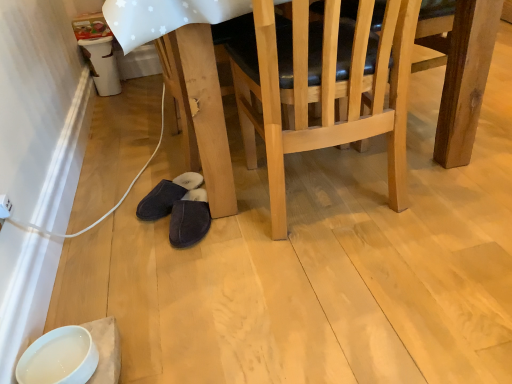
Consider the image. Measure the distance between point (189, 245) and camera.

Point (189, 245) is 4.06 feet away from camera.

How much space does dark suede slippers at lower center, marked as the second footwear in a right-to-left arrangement, occupy vertically?

It is 9.65 centimeters.

This screenshot has height=384, width=512. Describe the element at coordinates (59, 357) in the screenshot. I see `white glossy bowl at lower left` at that location.

Where is `white glossy bowl at lower left`? This screenshot has height=384, width=512. white glossy bowl at lower left is located at coordinates (59, 357).

This screenshot has height=384, width=512. I want to click on dark suede slippers at lower center, the first footwear when ordered from right to left, so click(x=189, y=219).

From a real-world perspective, who is located lower, dark suede slippers at lower center, the first footwear when ordered from left to right, or white glossy bowl at lower left?

From a 3D spatial view, dark suede slippers at lower center, the first footwear when ordered from left to right, is below.

In terms of width, does dark suede slippers at lower center, the first footwear when ordered from left to right, look wider or thinner when compared to white glossy bowl at lower left?

In the image, dark suede slippers at lower center, the first footwear when ordered from left to right, appears to be wider than white glossy bowl at lower left.

Would you say dark suede slippers at lower center, the first footwear when ordered from left to right, contains white glossy bowl at lower left?

No, white glossy bowl at lower left is not surrounded by dark suede slippers at lower center, the first footwear when ordered from left to right.

Between dark suede slippers at lower center, marked as the second footwear in a right-to-left arrangement, and white glossy bowl at lower left, which one appears on the left side from the viewer's perspective?

white glossy bowl at lower left is more to the left.

Are dark suede slippers at lower center, the first footwear when ordered from left to right, and wooden table at lower center located far from each other?

They are positioned close to each other.

From a real-world perspective, which object stands above the other?

wooden table at lower center.

Relative to wooden table at lower center, is dark suede slippers at lower center, the first footwear when ordered from left to right, in front or behind?

Clearly, dark suede slippers at lower center, the first footwear when ordered from left to right, is behind wooden table at lower center.

Is dark suede slippers at lower center, marked as the second footwear in a right-to-left arrangement, bigger than wooden table at lower center?

No, dark suede slippers at lower center, marked as the second footwear in a right-to-left arrangement, is not bigger than wooden table at lower center.

Measure the distance between dark suede slippers at lower center, the first footwear when ordered from right to left, and natural wood chair at center.

A distance of 18.83 inches exists between dark suede slippers at lower center, the first footwear when ordered from right to left, and natural wood chair at center.

Is dark suede slippers at lower center, arranged as the second footwear when viewed from the left, in front of or behind natural wood chair at center in the image?

Visually, dark suede slippers at lower center, arranged as the second footwear when viewed from the left, is located behind natural wood chair at center.

Could you tell me if dark suede slippers at lower center, the first footwear when ordered from right to left, is turned towards natural wood chair at center?

No.

From the image's perspective, which is below, dark suede slippers at lower center, the first footwear when ordered from right to left, or natural wood chair at center?

From the image's view, dark suede slippers at lower center, the first footwear when ordered from right to left, is below.

How different are the orientations of dark suede slippers at lower center, the first footwear when ordered from left to right, and natural wood chair at center in degrees?

142 degrees separate the facing orientations of dark suede slippers at lower center, the first footwear when ordered from left to right, and natural wood chair at center.

Is dark suede slippers at lower center, the first footwear when ordered from left to right, inside the boundaries of natural wood chair at center, or outside?

dark suede slippers at lower center, the first footwear when ordered from left to right, is located beyond the bounds of natural wood chair at center.

Which object is further away from the camera taking this photo, dark suede slippers at lower center, the first footwear when ordered from left to right, or natural wood chair at center?

dark suede slippers at lower center, the first footwear when ordered from left to right, is behind.

Which object is wider, dark suede slippers at lower center, the first footwear when ordered from left to right, or natural wood chair at center?

With larger width is natural wood chair at center.

Is point (210, 99) more distant than point (65, 357)?

Yes, it is.

Which object is closer to the camera taking this photo, wooden table at lower center or white glossy bowl at lower left?

Positioned in front is white glossy bowl at lower left.

From the image's perspective, is wooden table at lower center beneath white glossy bowl at lower left?

No.

Is wooden table at lower center inside the boundaries of white glossy bowl at lower left, or outside?

wooden table at lower center exists outside the volume of white glossy bowl at lower left.

Looking at the image, does white glossy bowl at lower left seem bigger or smaller compared to natural wood chair at center?

Clearly, white glossy bowl at lower left is smaller in size than natural wood chair at center.

Are white glossy bowl at lower left and natural wood chair at center beside each other?

No, white glossy bowl at lower left is not making contact with natural wood chair at center.

Can you tell me how much white glossy bowl at lower left and natural wood chair at center differ in facing direction?

They differ by 88.3 degrees in their facing directions.

Consider the image. Could you tell me if white glossy bowl at lower left is facing natural wood chair at center?

No, white glossy bowl at lower left is not oriented towards natural wood chair at center.

Is natural wood chair at center completely or partially outside of white glossy bowl at lower left?

Yes.

Is natural wood chair at center turned away from white glossy bowl at lower left?

That's not correct — natural wood chair at center is not looking away from white glossy bowl at lower left.

Is point (279, 230) closer to viewer compared to point (45, 339)?

That is False.

The width and height of the screenshot is (512, 384). Identify the location of bowl in front of the dark suede slippers at lower center, marked as the second footwear in a right-to-left arrangement. (59, 357).

Find the location of a particular element. This screenshot has width=512, height=384. table above the dark suede slippers at lower center, marked as the second footwear in a right-to-left arrangement (from a real-world perspective) is located at coordinates (462, 75).

From the image, which object appears to be nearer to wooden table at lower center, dark suede slippers at lower center, marked as the second footwear in a right-to-left arrangement, or white glossy bowl at lower left?

dark suede slippers at lower center, marked as the second footwear in a right-to-left arrangement, is closer to wooden table at lower center.

Estimate the real-world distances between objects in this image. Which object is further from white glossy bowl at lower left, dark suede slippers at lower center, arranged as the second footwear when viewed from the left, or natural wood chair at center?

natural wood chair at center is further to white glossy bowl at lower left.

Based on their spatial positions, is dark suede slippers at lower center, arranged as the second footwear when viewed from the left, or white glossy bowl at lower left closer to natural wood chair at center?

dark suede slippers at lower center, arranged as the second footwear when viewed from the left, lies closer to natural wood chair at center than the other object.

Which object lies further to the anchor point natural wood chair at center, wooden table at lower center or dark suede slippers at lower center, the first footwear when ordered from right to left?

Among the two, dark suede slippers at lower center, the first footwear when ordered from right to left, is located further to natural wood chair at center.

When comparing their distances from white glossy bowl at lower left, does dark suede slippers at lower center, the first footwear when ordered from left to right, or dark suede slippers at lower center, the first footwear when ordered from right to left, seem further?

dark suede slippers at lower center, the first footwear when ordered from left to right, is further to white glossy bowl at lower left.

Based on their spatial positions, is dark suede slippers at lower center, the first footwear when ordered from left to right, or natural wood chair at center closer to white glossy bowl at lower left?

dark suede slippers at lower center, the first footwear when ordered from left to right, lies closer to white glossy bowl at lower left than the other object.

When comparing their distances from dark suede slippers at lower center, the first footwear when ordered from right to left, does wooden table at lower center or dark suede slippers at lower center, the first footwear when ordered from left to right, seem further?

wooden table at lower center lies further to dark suede slippers at lower center, the first footwear when ordered from right to left, than the other object.

Looking at this image, estimate the real-world distances between objects in this image. Which object is further from white glossy bowl at lower left, natural wood chair at center or dark suede slippers at lower center, the first footwear when ordered from right to left?

Based on the image, natural wood chair at center appears to be further to white glossy bowl at lower left.

Identify the location of footwear between white glossy bowl at lower left and dark suede slippers at lower center, the first footwear when ordered from left to right, along the z-axis. (189, 219).

Locate an element on the screen. chair between wooden table at lower center and dark suede slippers at lower center, marked as the second footwear in a right-to-left arrangement, from top to bottom is located at coordinates (324, 87).

At what (x,y) coordinates should I click in order to perform the action: click on footwear between wooden table at lower center and dark suede slippers at lower center, the first footwear when ordered from right to left, in the vertical direction. Please return your answer as a coordinate pair (x, y). Image resolution: width=512 pixels, height=384 pixels. Looking at the image, I should click on (166, 196).

Identify the location of chair between wooden table at lower center and white glossy bowl at lower left in the up-down direction. The height and width of the screenshot is (384, 512). (324, 87).